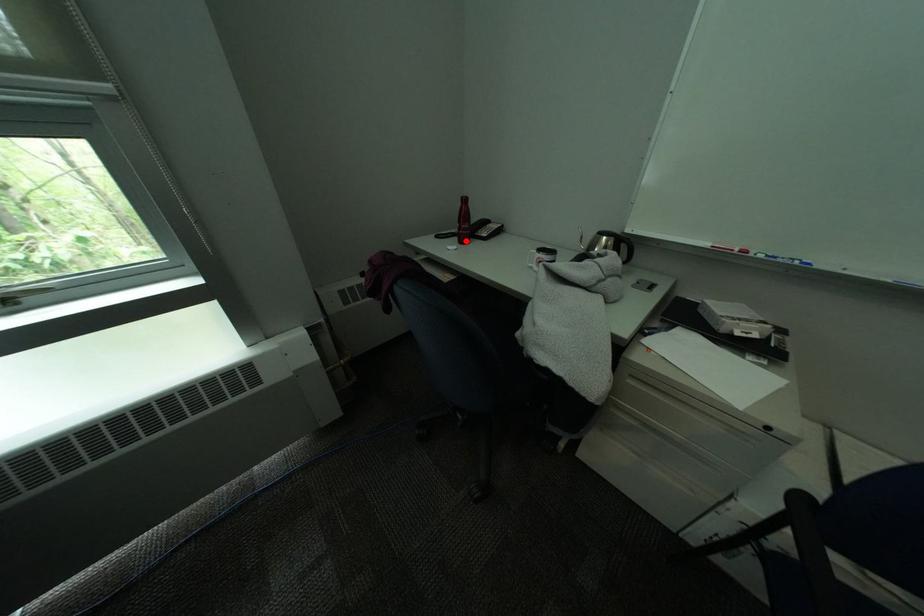
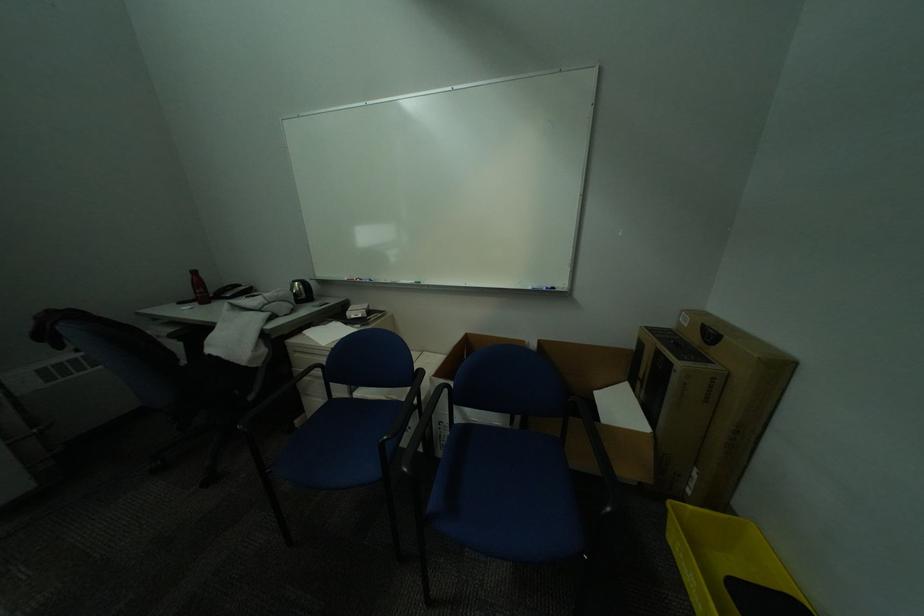
Find the pixel in the second image that matches the highlighted location in the first image.

(208, 304)